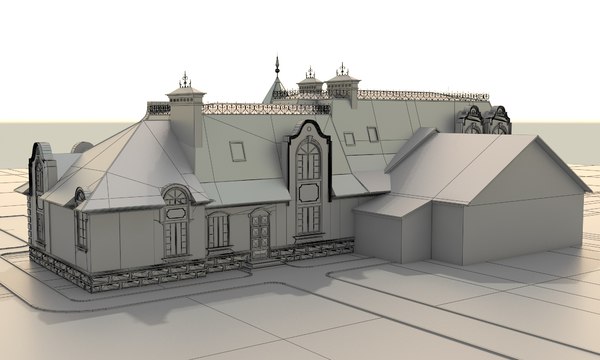
Locate an element on the screen. The height and width of the screenshot is (360, 600). door is located at coordinates (261, 241).